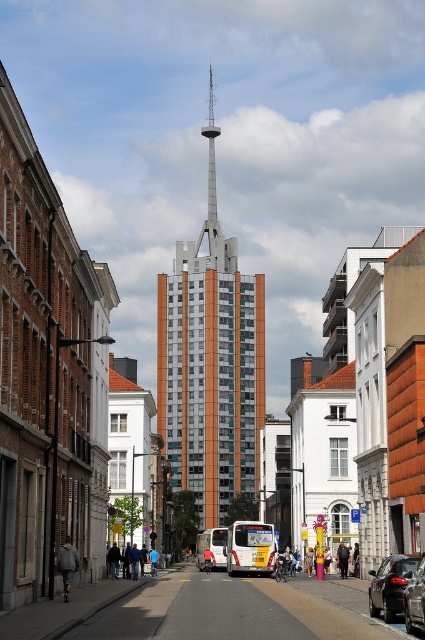
Does shiny black car at lower right appear on the left side of shiny black sedan at center?

No, shiny black car at lower right is not to the left of shiny black sedan at center.

Can you confirm if shiny black car at lower right is positioned below shiny black sedan at center?

Yes.

This screenshot has height=640, width=425. What are the coordinates of `shiny black car at lower right` in the screenshot? It's located at (391, 586).

What do you see at coordinates (414, 598) in the screenshot? The image size is (425, 640). I see `shiny black sedan at center` at bounding box center [414, 598].

Who is more distant from viewer, (x=405, y=630) or (x=206, y=557)?

The point (x=206, y=557) is behind.

This screenshot has height=640, width=425. I want to click on shiny black sedan at center, so click(414, 598).

Is shiny black car at lower right above light brown leather jacket at center?

Indeed, shiny black car at lower right is positioned over light brown leather jacket at center.

Does shiny black car at lower right appear on the left side of light brown leather jacket at center?

Correct, you'll find shiny black car at lower right to the left of light brown leather jacket at center.

Between point (387, 596) and point (345, 577), which one is positioned behind?

The point (345, 577) is more distant.

What are the coordinates of `shiny black car at lower right` in the screenshot? It's located at (391, 586).